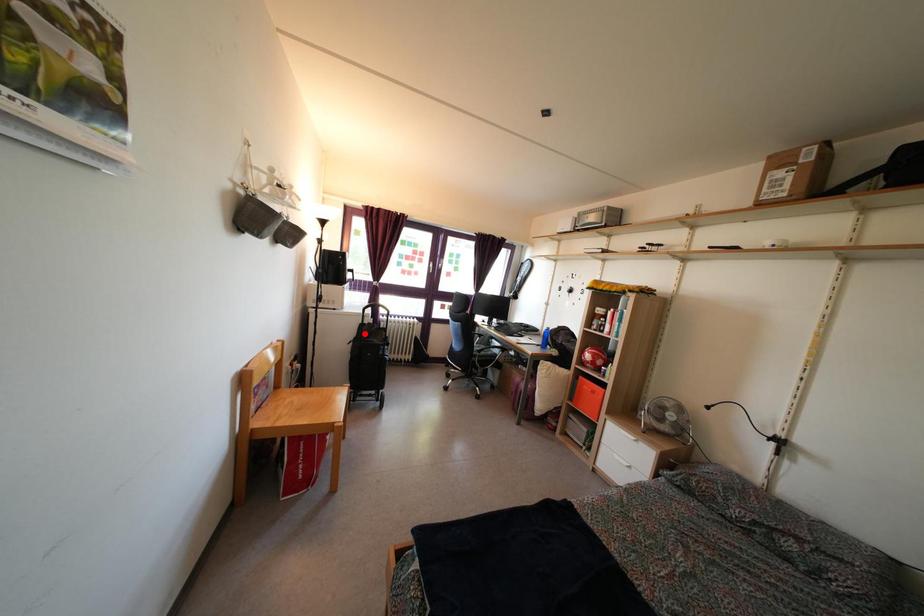
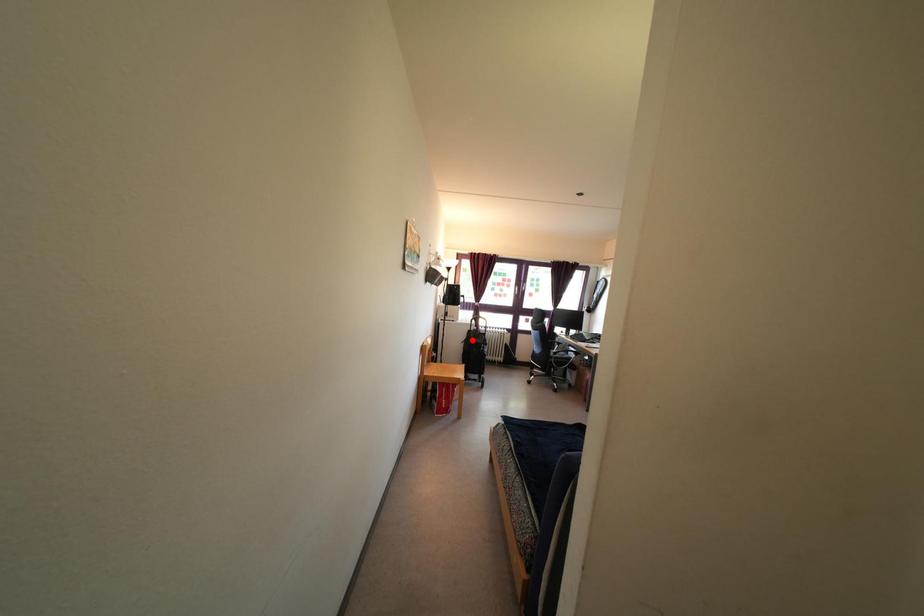
I am providing you with two images of the same scene from different viewpoints. A red point is marked on the first image and another point is marked on the second image. Does the point marked in image1 correspond to the same location as the one in image2?

Yes